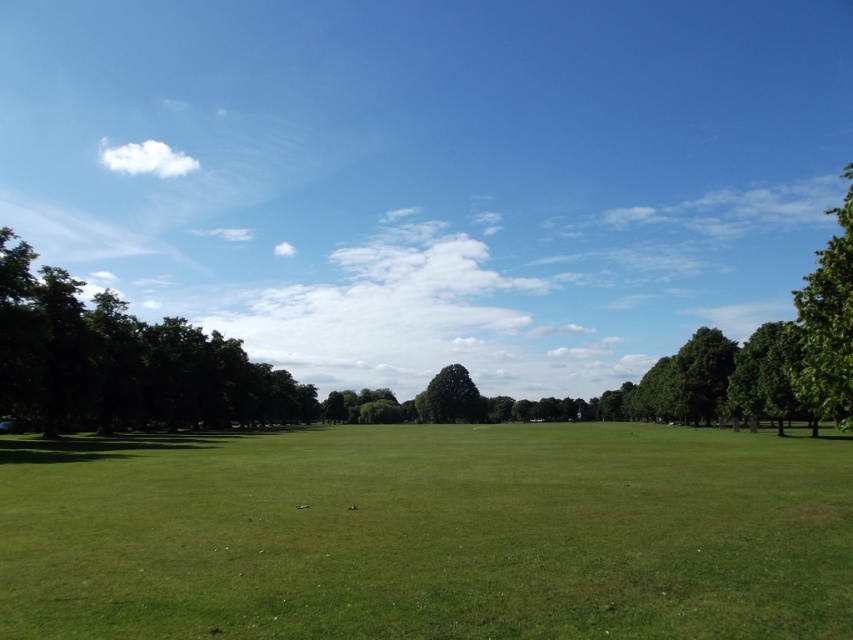
Is green leafy tree at left smaller than green leafy tree at right?

Indeed, green leafy tree at left has a smaller size compared to green leafy tree at right.

Is point (206, 397) positioned behind point (837, 276)?

Yes, point (206, 397) is behind point (837, 276).

Which is behind, point (177, 417) or point (846, 176)?

Positioned behind is point (846, 176).

This screenshot has width=853, height=640. I want to click on green leafy tree at left, so click(x=122, y=358).

Between green leafy tree at left and green leafy tree at center, which one has more height?

Standing taller between the two is green leafy tree at left.

Which is behind, point (236, 342) or point (456, 385)?

Positioned behind is point (456, 385).

This screenshot has width=853, height=640. Describe the element at coordinates (122, 358) in the screenshot. I see `green leafy tree at left` at that location.

Find the location of a particular element. green leafy tree at left is located at coordinates (122, 358).

Who is more forward, (10, 602) or (426, 400)?

Point (10, 602)

Who is more distant from viewer, (50, 509) or (477, 390)?

Point (477, 390)

Between point (733, 500) and point (451, 397), which one is positioned in front?

Point (733, 500) is more forward.

Locate an element on the screen. This screenshot has width=853, height=640. green grass at center is located at coordinates (427, 532).